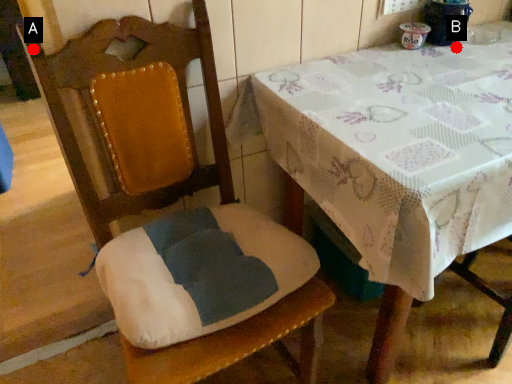
Question: Two points are circled on the image, labeled by A and B beside each circle. Among these points, which one is nearest to the camera?

Choices:
 (A) A is closer
 (B) B is closer

Answer: (A)